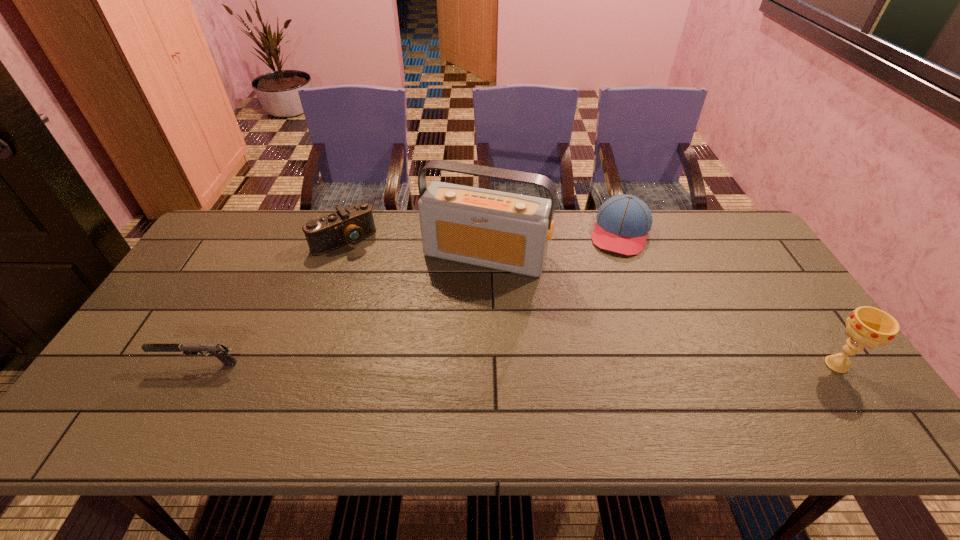
You are a GUI agent. You are given a task and a screenshot of the screen. Output one action in this format:
    pyautogui.click(x=<x>, y=<y>)
    Task: Click on the vacant space on the desktop that is between the leftmost object and the chalice and is positioned on the front-facing side of the tallest object
    This screenshot has width=960, height=540.
    Given the screenshot: What is the action you would take?
    pyautogui.click(x=439, y=364)

Locate an element on the screen. vacant space on the desktop that is between the gun and the rightmost object and is positioned on the front-facing side of the baseball cap is located at coordinates (579, 364).

Find the location of a particular element. free spot on the desktop that is between the leftmost object and the rightmost object and is positioned on the lens of the fourth object from right to left is located at coordinates (444, 364).